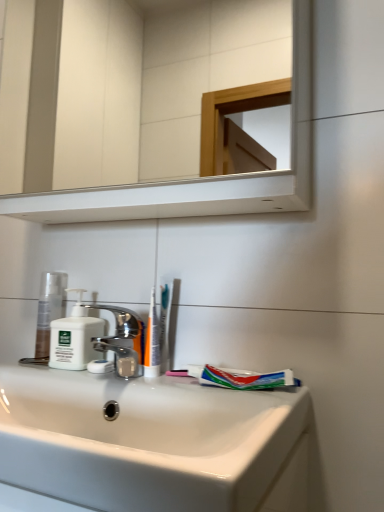
Where is `vacant space underneath white glossy mirror at upper center (from a real-world perspective)`? This screenshot has height=512, width=384. vacant space underneath white glossy mirror at upper center (from a real-world perspective) is located at coordinates (146, 382).